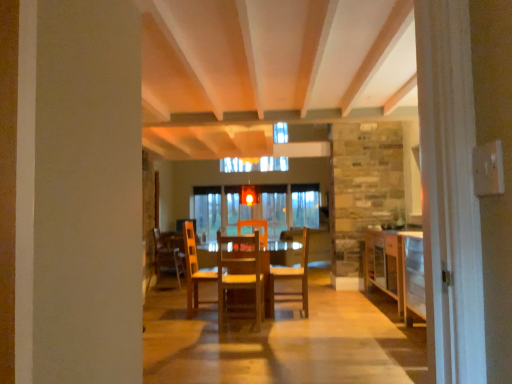
Question: Considering the positions of wooden cabinet at right and wooden chair at center, which appears as the third chair when viewed from the left, in the image, is wooden cabinet at right taller or shorter than wooden chair at center, which appears as the third chair when viewed from the left,?

Choices:
 (A) tall
 (B) short

Answer: (B)

Question: Is point (373, 236) closer or farther from the camera than point (307, 271)?

Choices:
 (A) farther
 (B) closer

Answer: (A)

Question: Which of these objects is positioned closest to the wooden cabinet at right?

Choices:
 (A) wooden chair at center, the third chair viewed from the front
 (B) wooden chair at center, which appears as the third chair when viewed from the left
 (C) wooden chair at center, the 1th chair positioned from the front
 (D) wooden table at center

Answer: (B)

Question: Estimate the real-world distances between objects in this image. Which object is closer to the wooden chair at center, which is the 1th chair in back-to-front order?

Choices:
 (A) wooden cabinet at right
 (B) wooden chair at center, the second chair in the right-to-left sequence
 (C) wooden chair at center, the second chair when ordered from front to back
 (D) wooden table at center

Answer: (D)